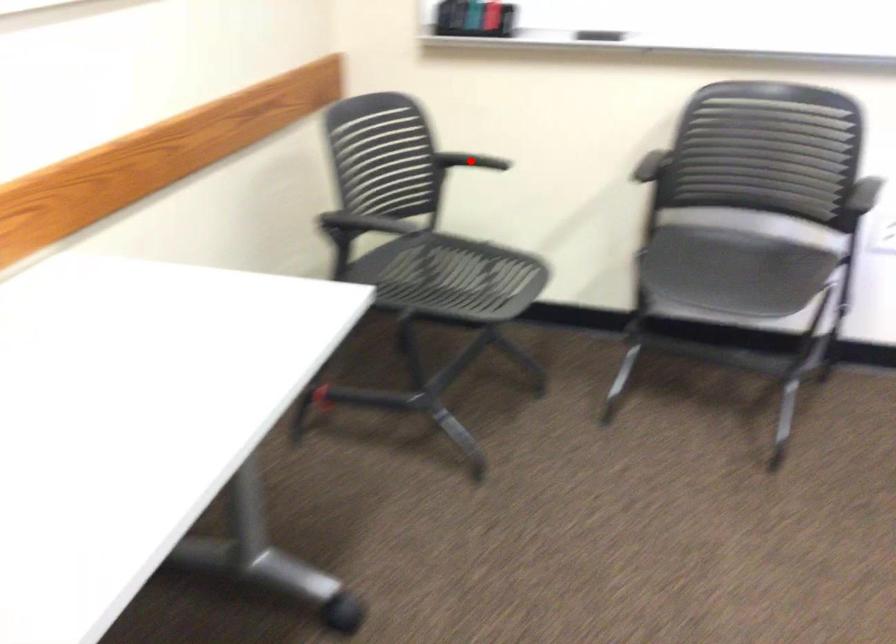
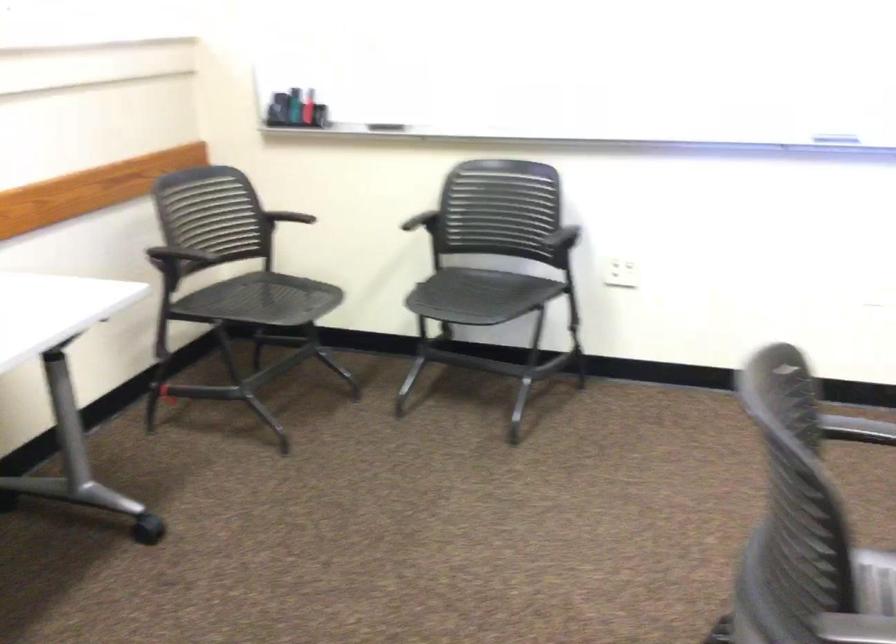
In the second image, find the point that corresponds to the highlighted location in the first image.

(291, 214)